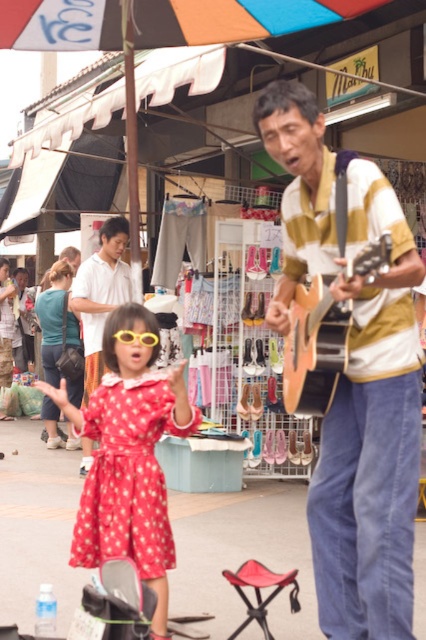
Is point (405, 592) positioned behind point (120, 358)?

No, (405, 592) is in front of (120, 358).

This screenshot has height=640, width=426. Find the location of `wooden acoustic guitar at center`. wooden acoustic guitar at center is located at coordinates (354, 376).

Can you confirm if matte white shirt at upper left is wider than yellow plastic goggles at center?

Yes.

Identify the location of matte white shirt at upper left. The width and height of the screenshot is (426, 640). (100, 294).

Identify the location of matte white shirt at upper left. (100, 294).

Does point (88, 326) lie in front of point (273, 589)?

That is False.

Is matte white shirt at upper left thinner than red fabric stool at lower center?

No, matte white shirt at upper left is not thinner than red fabric stool at lower center.

Is point (85, 403) closer to camera compared to point (279, 579)?

No, (85, 403) is further to viewer.

Locate an element on the screen. The width and height of the screenshot is (426, 640). matte white shirt at upper left is located at coordinates (100, 294).